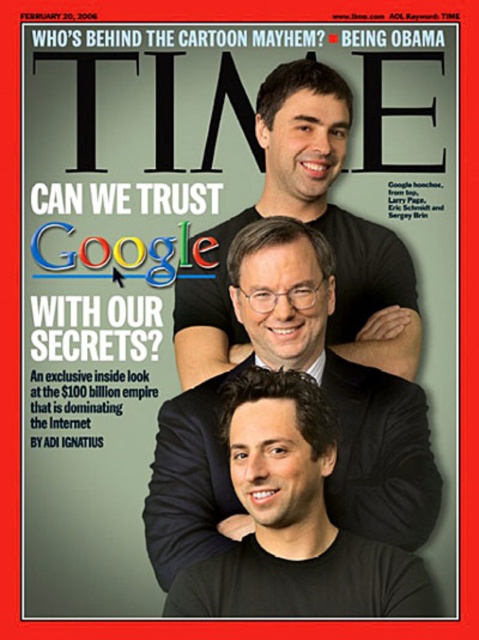
You are a graphic designer working on the Time magazine cover. You need to add a new element between the two points marked as point (350, 474) and point (326, 116). Which point should the new element be closer to so that it appears in front of both points?

The new element should be closer to point (350, 474) because it is closer to the viewer than point (326, 116), so placing it near that point will make it appear in front of both.